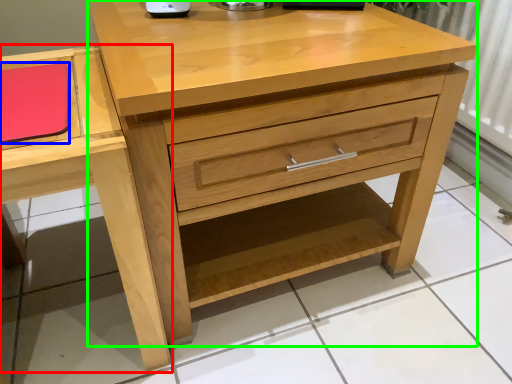
Question: Which object is the farthest from vanity (highlighted by a red box)? Choose among these: notepad (highlighted by a blue box) or chest of drawers (highlighted by a green box).

Choices:
 (A) notepad
 (B) chest of drawers

Answer: (B)